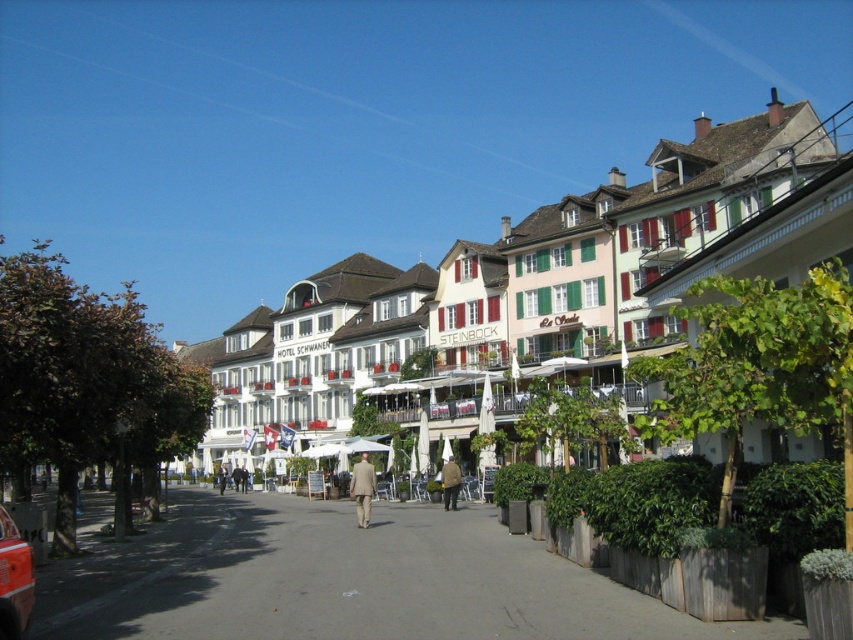
You are a tourist standing on the street and see the white matte building at center and the brown leather jacket at center. Which object is closer to the left side of the street?

The brown leather jacket at center is closer to the left side of the street because the white matte building at center is positioned to its right.

You are standing at the center of the street looking towards the buildings. Where is the metallic red car at lower left located relative to your position?

The metallic red car at lower left is located at the lower left side of the scene, positioned at coordinates approximately 0.906 on the x axis and 0.018 on the y axis.

Based on the photo, you are a tourist standing on the left side of the street in the European town scene. You see a light beige suit at center. Which direction should you walk to reach it?

Since the light beige suit at center is located at coordinates approximately 0.764 on the x axis and 0.426 on the y axis, you should walk towards the center of the street from the left side to reach it.